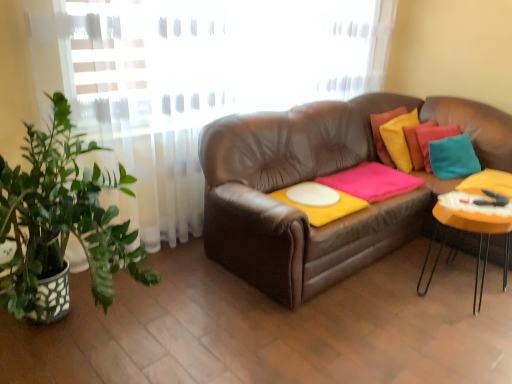
Question: Is the depth of orange matte table at right greater than that of pink matte blanket at center?

Choices:
 (A) yes
 (B) no

Answer: (B)

Question: Can you confirm if orange matte table at right is taller than pink matte blanket at center?

Choices:
 (A) yes
 (B) no

Answer: (A)

Question: Does orange matte table at right have a lesser height compared to pink matte blanket at center?

Choices:
 (A) yes
 (B) no

Answer: (B)

Question: Considering the relative sizes of orange matte table at right and pink matte blanket at center in the image provided, is orange matte table at right thinner than pink matte blanket at center?

Choices:
 (A) yes
 (B) no

Answer: (A)

Question: From a real-world perspective, does orange matte table at right sit lower than pink matte blanket at center?

Choices:
 (A) yes
 (B) no

Answer: (A)

Question: Considering the positions of pink matte blanket at center and orange matte table at right in the image, is pink matte blanket at center bigger or smaller than orange matte table at right?

Choices:
 (A) small
 (B) big

Answer: (A)

Question: Considering the positions of pink matte blanket at center and orange matte table at right in the image, is pink matte blanket at center taller or shorter than orange matte table at right?

Choices:
 (A) tall
 (B) short

Answer: (B)

Question: In terms of width, does pink matte blanket at center look wider or thinner when compared to orange matte table at right?

Choices:
 (A) thin
 (B) wide

Answer: (B)

Question: From the image's perspective, relative to orange matte table at right, is pink matte blanket at center above or below?

Choices:
 (A) above
 (B) below

Answer: (A)

Question: Is point (327, 216) positioned closer to the camera than point (355, 175)?

Choices:
 (A) farther
 (B) closer

Answer: (B)

Question: Considering the positions of white matte round table at center and pink matte blanket at center in the image, is white matte round table at center taller or shorter than pink matte blanket at center?

Choices:
 (A) tall
 (B) short

Answer: (B)

Question: Based on their positions, is white matte round table at center located to the left or right of pink matte blanket at center?

Choices:
 (A) right
 (B) left

Answer: (B)

Question: In terms of size, does white matte round table at center appear bigger or smaller than pink matte blanket at center?

Choices:
 (A) big
 (B) small

Answer: (B)

Question: Is orange matte table at right to the left or to the right of white matte round table at center in the image?

Choices:
 (A) right
 (B) left

Answer: (A)

Question: From a real-world perspective, relative to white matte round table at center, is orange matte table at right vertically above or below?

Choices:
 (A) below
 (B) above

Answer: (A)